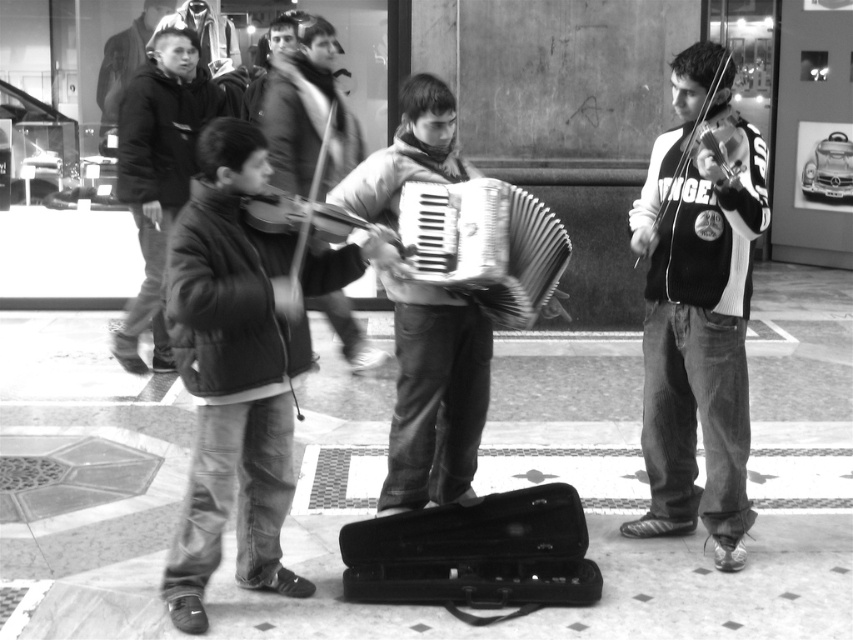
Based on the scene description, where is the metallic silver accordion at center located in terms of coordinates?

The metallic silver accordion at center is located at coordinates point (485, 244).

You are standing in the street performance scene. There are two points marked in the image. The first point is at coordinates point (523, 232) and the second point is at point (128, 186). Which of these two points is closer to you?

Point (523, 232) is closer to the viewer than point (128, 186).

You are a photographer trying to capture the performer in the white sweater at right and the shiny black violin at right in the same frame. Based on their positions, which performer is closer to the right edge of the photo?

The white sweater at right is to the right of the shiny black violin at right, so the performer in the white sweater at right is closer to the right edge of the photo.